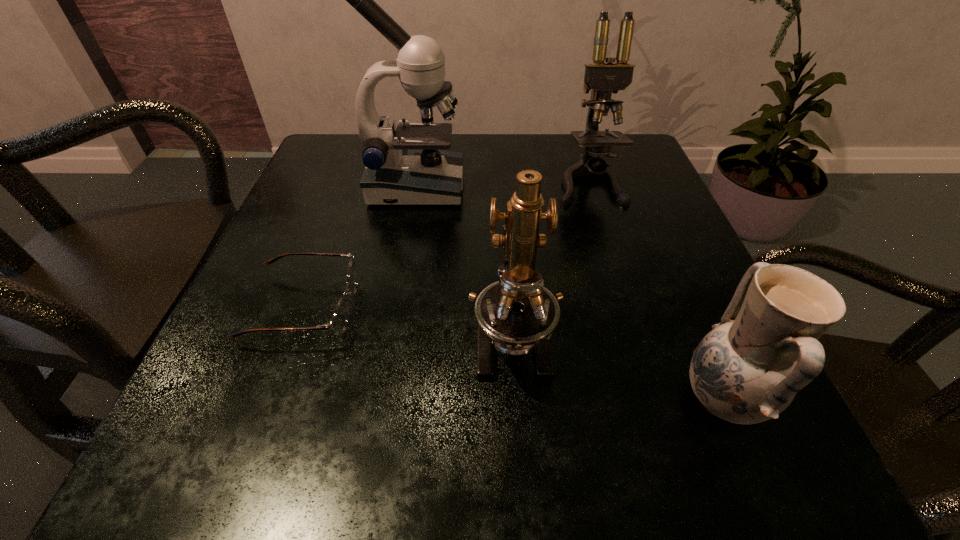
Locate an element on the screen. This screenshot has width=960, height=540. object located at the far right corner is located at coordinates (603, 79).

This screenshot has width=960, height=540. Identify the location of object situated at the near right corner. (748, 369).

Identify the location of free space at the far edge. The height and width of the screenshot is (540, 960). (514, 165).

Locate an element on the screen. The width and height of the screenshot is (960, 540). free space at the near edge is located at coordinates (621, 431).

In the image, there is a desktop. At what (x,y) coordinates should I click in order to perform the action: click on free space at the left edge. Please return your answer as a coordinate pair (x, y). Looking at the image, I should click on (311, 211).

Find the location of `free space at the right edge`. free space at the right edge is located at coordinates (637, 230).

Where is `vacant space at the far left corner of the desktop`? This screenshot has width=960, height=540. vacant space at the far left corner of the desktop is located at coordinates (357, 133).

Find the location of a particular element. This screenshot has width=960, height=540. vacant region at the far right corner of the desktop is located at coordinates (639, 185).

The width and height of the screenshot is (960, 540). In the image, there is a desktop. Find the location of `free space at the near right corner`. free space at the near right corner is located at coordinates click(792, 445).

Locate an element on the screen. free space between the tallest microscope and the shortest object is located at coordinates (359, 247).